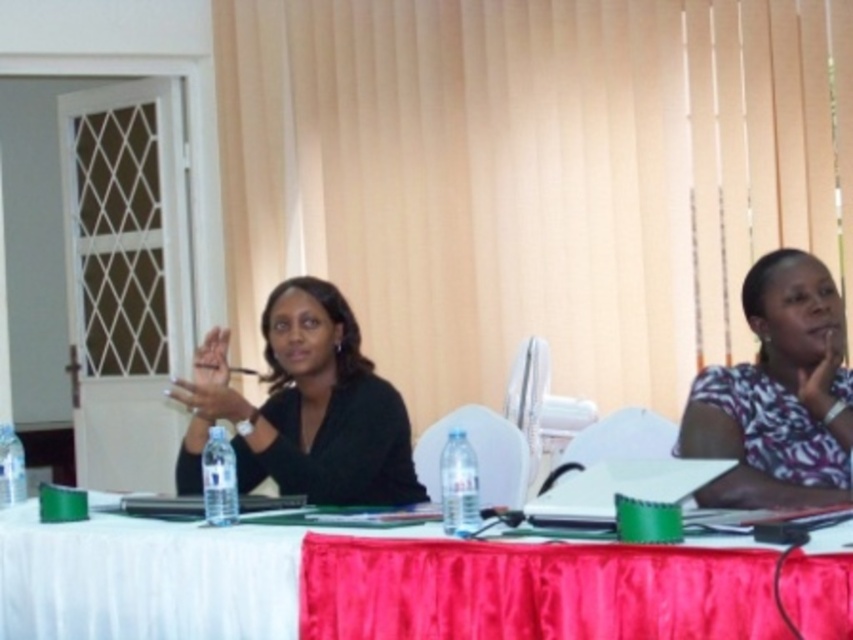
Question: Among these objects, which one is farthest from the camera?

Choices:
 (A) printed cotton shirt at right
 (B) black matte shirt at center
 (C) white fabric table at center

Answer: (B)

Question: Is white fabric table at center wider than black matte shirt at center?

Choices:
 (A) no
 (B) yes

Answer: (B)

Question: Which of these objects is positioned farthest from the white fabric table at center?

Choices:
 (A) printed cotton shirt at right
 (B) black matte shirt at center

Answer: (A)

Question: From the image, what is the correct spatial relationship of white fabric table at center in relation to black matte shirt at center?

Choices:
 (A) right
 (B) left

Answer: (A)

Question: Which of the following is the farthest from the observer?

Choices:
 (A) white fabric table at center
 (B) black matte shirt at center
 (C) printed cotton shirt at right

Answer: (B)

Question: Can you confirm if black matte shirt at center is wider than printed cotton shirt at right?

Choices:
 (A) no
 (B) yes

Answer: (B)